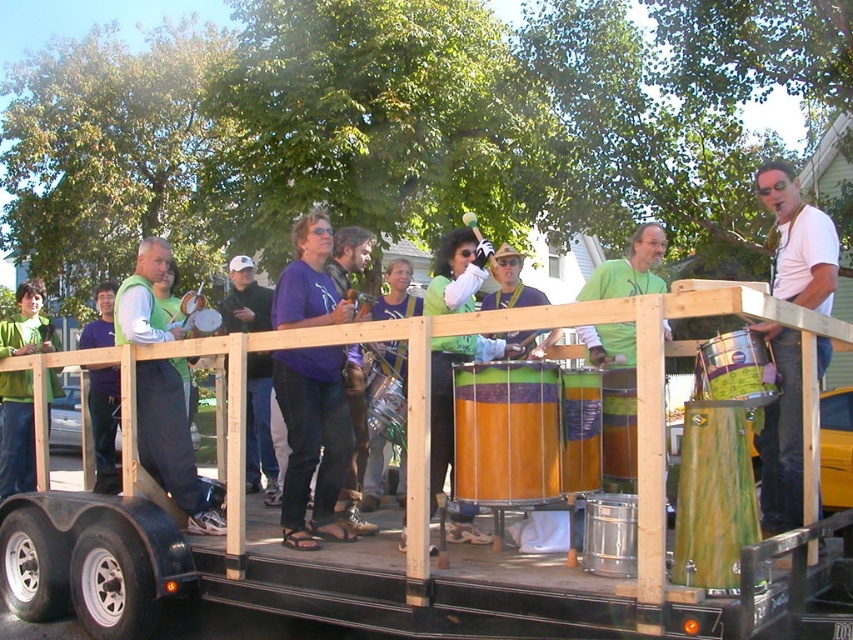
Consider the image. Does green matte vest at left appear on the right side of green matte drum at center?

No, green matte vest at left is not to the right of green matte drum at center.

Does green matte vest at left have a greater width compared to green matte drum at center?

Yes, green matte vest at left is wider than green matte drum at center.

Does point (142, 321) lie in front of point (656, 288)?

Yes, it is.

The image size is (853, 640). In order to click on green matte vest at left in this screenshot , I will do [173, 445].

Does green matte jacket at left have a greater width compared to green matte drum at center?

No, green matte jacket at left is not wider than green matte drum at center.

Does green matte jacket at left appear on the left side of green matte drum at center?

Yes, green matte jacket at left is to the left of green matte drum at center.

The image size is (853, 640). I want to click on green matte jacket at left, so click(x=16, y=433).

In order to click on purple matte shirt at center in this screenshot , I will do `click(259, 426)`.

Can you confirm if purple matte shirt at center is positioned below green matte drum at center?

Correct, purple matte shirt at center is located below green matte drum at center.

Find the location of a particular element. purple matte shirt at center is located at coordinates (259, 426).